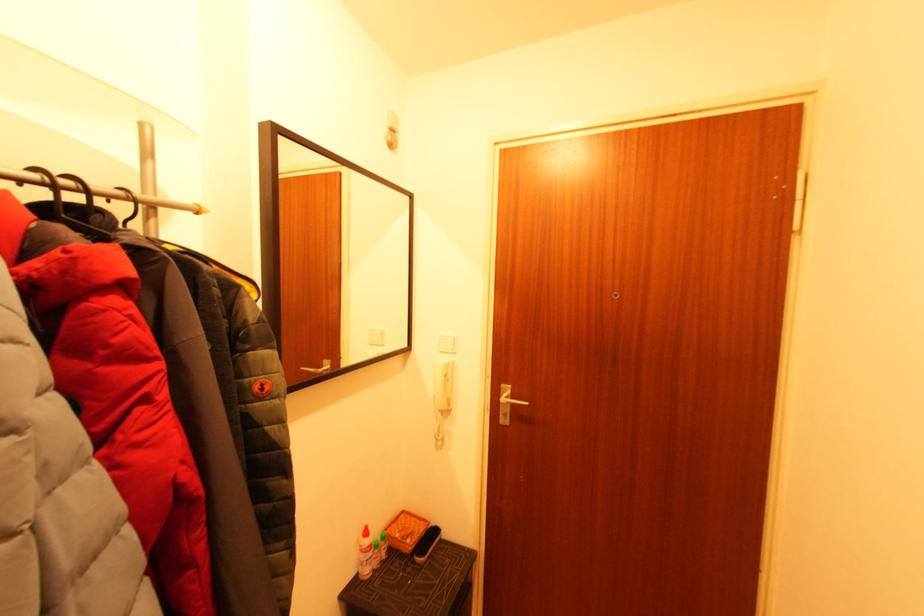
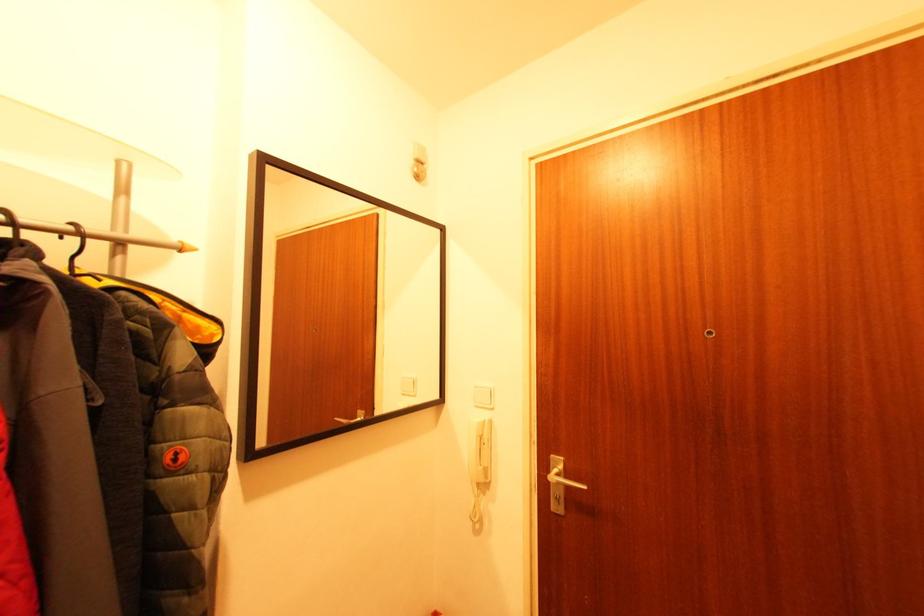
The point at (x=450, y=408) is marked in the first image. Where is the corresponding point in the second image?

(487, 480)